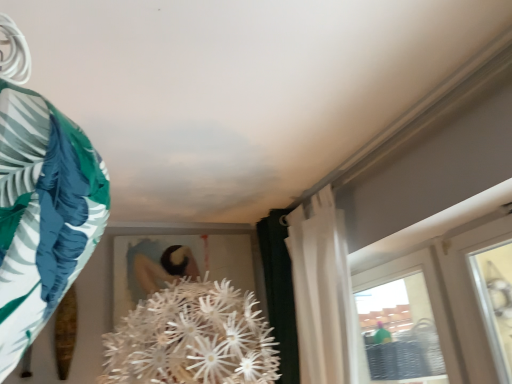
Question: Are green fabric at left and white sheer curtain at upper right located far from each other?

Choices:
 (A) no
 (B) yes

Answer: (B)

Question: Considering the relative sizes of green fabric at left and white sheer curtain at upper right in the image provided, is green fabric at left smaller than white sheer curtain at upper right?

Choices:
 (A) no
 (B) yes

Answer: (B)

Question: From a real-world perspective, is green fabric at left over white sheer curtain at upper right?

Choices:
 (A) yes
 (B) no

Answer: (A)

Question: Is green fabric at left shorter than white sheer curtain at upper right?

Choices:
 (A) yes
 (B) no

Answer: (A)

Question: Is green fabric at left bigger than white sheer curtain at upper right?

Choices:
 (A) yes
 (B) no

Answer: (B)

Question: Is green fabric at left taller than white sheer curtain at upper right?

Choices:
 (A) no
 (B) yes

Answer: (A)

Question: From the image's perspective, does white sheer curtain at upper right appear lower than green fabric at left?

Choices:
 (A) yes
 (B) no

Answer: (A)

Question: From a real-world perspective, is white sheer curtain at upper right positioned over green fabric at left based on gravity?

Choices:
 (A) no
 (B) yes

Answer: (A)

Question: Is white sheer curtain at upper right positioned far away from green fabric at left?

Choices:
 (A) yes
 (B) no

Answer: (A)

Question: Is white sheer curtain at upper right at the left side of green fabric at left?

Choices:
 (A) yes
 (B) no

Answer: (B)

Question: Does white sheer curtain at upper right have a larger size compared to green fabric at left?

Choices:
 (A) no
 (B) yes

Answer: (B)

Question: Is white sheer curtain at upper right positioned behind green fabric at left?

Choices:
 (A) no
 (B) yes

Answer: (B)

Question: Is white sheer curtain at upper right inside the boundaries of green fabric at left, or outside?

Choices:
 (A) inside
 (B) outside

Answer: (B)